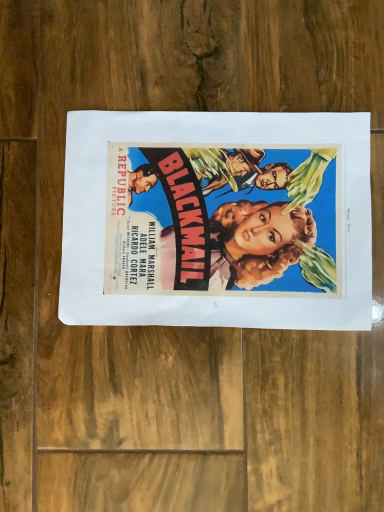
What is the approximate width of matte paper poster at center?

matte paper poster at center is 30.34 centimeters in width.

This screenshot has height=512, width=384. Describe the element at coordinates (217, 220) in the screenshot. I see `matte paper poster at center` at that location.

At what (x,y) coordinates should I click in order to perform the action: click on matte paper poster at center. Please return your answer as a coordinate pair (x, y). This screenshot has width=384, height=512. Looking at the image, I should click on (217, 220).

The width and height of the screenshot is (384, 512). Identify the location of matte paper poster at center. (217, 220).